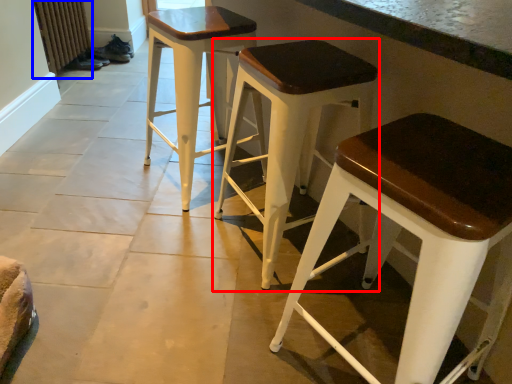
Question: Which object is further to the camera taking this photo, stool (highlighted by a red box) or radiator (highlighted by a blue box)?

Choices:
 (A) stool
 (B) radiator

Answer: (B)